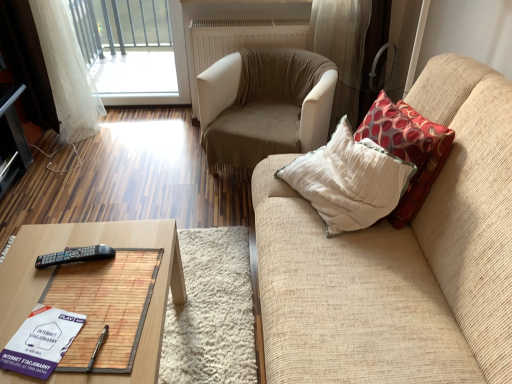
Describe the element at coordinates (408, 149) in the screenshot. The width and height of the screenshot is (512, 384). I see `red patterned fabric pillow at right` at that location.

What do you see at coordinates (41, 341) in the screenshot?
I see `purple paper book at lower left` at bounding box center [41, 341].

Describe the element at coordinates (88, 245) in the screenshot. I see `woodenwoodentable at lower left` at that location.

Measure the distance between point (123, 378) and camera.

Point (123, 378) is 1.10 meters away from camera.

What do you see at coordinates (133, 46) in the screenshot? This screenshot has height=384, width=512. I see `transparent glass window at upper left` at bounding box center [133, 46].

Measure the distance between beige fabric armchair at center and camera.

They are 2.05 meters apart.

This screenshot has height=384, width=512. In order to click on beige fabric couch at right in this screenshot , I will do `click(400, 260)`.

Is black plastic remote at lower left far away from red patterned fabric pillow at right?

Yes, black plastic remote at lower left and red patterned fabric pillow at right are located far from each other.

Is black plastic remote at lower left inside or outside of red patterned fabric pillow at right?

black plastic remote at lower left is not enclosed by red patterned fabric pillow at right.

How much distance is there between black plastic remote at lower left and red patterned fabric pillow at right?

A distance of 3.67 feet exists between black plastic remote at lower left and red patterned fabric pillow at right.

Where is `throw pillow on the right of black plastic remote at lower left`? throw pillow on the right of black plastic remote at lower left is located at coordinates (408, 149).

Is transparent glass window at upper left facing towards purple paper book at lower left?

Yes.

From the image's perspective, which is above, transparent glass window at upper left or purple paper book at lower left?

transparent glass window at upper left, from the image's perspective.

Looking at their sizes, would you say transparent glass window at upper left is wider or thinner than purple paper book at lower left?

Considering their sizes, transparent glass window at upper left looks slimmer than purple paper book at lower left.

Consider the image. Relative to red patterned fabric pillow at right, is beige fabric armchair at center in front or behind?

beige fabric armchair at center is positioned farther from the viewer than red patterned fabric pillow at right.

Can you tell me how much beige fabric armchair at center and red patterned fabric pillow at right differ in facing direction?

The facing directions of beige fabric armchair at center and red patterned fabric pillow at right are 63.2 degrees apart.

Is beige fabric armchair at center aimed at red patterned fabric pillow at right?

No, beige fabric armchair at center is not turned towards red patterned fabric pillow at right.

Is beige fabric armchair at center inside the boundaries of red patterned fabric pillow at right, or outside?

beige fabric armchair at center cannot be found inside red patterned fabric pillow at right.

Is black glossy tv stand at left facing away from beige fabric couch at right?

No, beige fabric couch at right is not at the back of black glossy tv stand at left.

Looking at this image, considering the positions of objects black glossy tv stand at left and beige fabric couch at right in the image provided, who is more to the left, black glossy tv stand at left or beige fabric couch at right?

Positioned to the left is black glossy tv stand at left.

Are black glossy tv stand at left and beige fabric couch at right making contact?

black glossy tv stand at left and beige fabric couch at right are clearly separated.

Does black glossy tv stand at left have a greater height compared to beige fabric couch at right?

Incorrect, the height of black glossy tv stand at left is not larger of that of beige fabric couch at right.

Measure the distance between beige fabric couch at right and black glossy tv stand at left.

beige fabric couch at right is 6.41 feet away from black glossy tv stand at left.

Which object is further away from the camera, beige fabric couch at right or black glossy tv stand at left?

black glossy tv stand at left is further from the camera.

Which object is wider, beige fabric couch at right or black glossy tv stand at left?

Wider between the two is beige fabric couch at right.

Who is bigger, beige fabric couch at right or black glossy tv stand at left?

beige fabric couch at right is bigger.

Based on their positions, is beige fabric couch at right located to the left or right of black plastic remote at lower left?

Clearly, beige fabric couch at right is on the right of black plastic remote at lower left in the image.

Considering the sizes of beige fabric couch at right and black plastic remote at lower left in the image, is beige fabric couch at right wider or thinner than black plastic remote at lower left?

Clearly, beige fabric couch at right has more width compared to black plastic remote at lower left.

Are beige fabric couch at right and black plastic remote at lower left located far from each other?

They are positioned close to each other.

Is beige fabric couch at right behind black plastic remote at lower left?

That is False.

Does beige fabric couch at right have a larger size compared to beige fabric armchair at center?

Indeed, beige fabric couch at right has a larger size compared to beige fabric armchair at center.

Could you tell me if beige fabric couch at right is facing beige fabric armchair at center?

No, beige fabric couch at right is not aimed at beige fabric armchair at center.

Would you say beige fabric couch at right is inside or outside beige fabric armchair at center?

beige fabric couch at right cannot be found inside beige fabric armchair at center.

Considering the positions of objects beige fabric couch at right and beige fabric armchair at center in the image provided, who is behind, beige fabric couch at right or beige fabric armchair at center?

beige fabric armchair at center.

Where is `remote in front of the red patterned fabric pillow at right`? This screenshot has height=384, width=512. remote in front of the red patterned fabric pillow at right is located at coordinates (75, 255).

I want to click on book above the transparent glass window at upper left (from a real-world perspective), so click(x=41, y=341).

Based on their spatial positions, is transparent glass window at upper left or beige fabric couch at right closer to black plastic remote at lower left?

beige fabric couch at right lies closer to black plastic remote at lower left than the other object.

Based on their spatial positions, is red patterned fabric pillow at right or woodenwoodentable at lower left further from beige fabric couch at right?

woodenwoodentable at lower left is further to beige fabric couch at right.

From the image, which object appears to be farther from woodenwoodentable at lower left, black glossy tv stand at left or red patterned fabric pillow at right?

black glossy tv stand at left lies further to woodenwoodentable at lower left than the other object.

When comparing their distances from woodenwoodentable at lower left, does beige fabric couch at right or transparent glass window at upper left seem further?

transparent glass window at upper left.

Looking at this image, looking at the image, which one is located closer to beige fabric couch at right, black glossy tv stand at left or purple paper book at lower left?

The object closer to beige fabric couch at right is purple paper book at lower left.

When comparing their distances from woodenwoodentable at lower left, does purple paper book at lower left or black glossy tv stand at left seem closer?

purple paper book at lower left is closer to woodenwoodentable at lower left.

From the picture: When comparing their distances from beige fabric couch at right, does woodenwoodentable at lower left or red patterned fabric pillow at right seem further?

woodenwoodentable at lower left.

From the image, which object appears to be nearer to purple paper book at lower left, woodenwoodentable at lower left or transparent glass window at upper left?

woodenwoodentable at lower left.

Locate an element on the screen. entertainment center between woodenwoodentable at lower left and transparent glass window at upper left in the front-back direction is located at coordinates (11, 137).

Identify the location of remote located between black glossy tv stand at left and red patterned fabric pillow at right in the left-right direction. This screenshot has width=512, height=384. (75, 255).

Image resolution: width=512 pixels, height=384 pixels. Identify the location of studio couch between black glossy tv stand at left and red patterned fabric pillow at right in the horizontal direction. pos(400,260).

At what (x,y) coordinates should I click in order to perform the action: click on chair between purple paper book at lower left and red patterned fabric pillow at right. Please return your answer as a coordinate pair (x, y). Image resolution: width=512 pixels, height=384 pixels. Looking at the image, I should click on (264, 106).